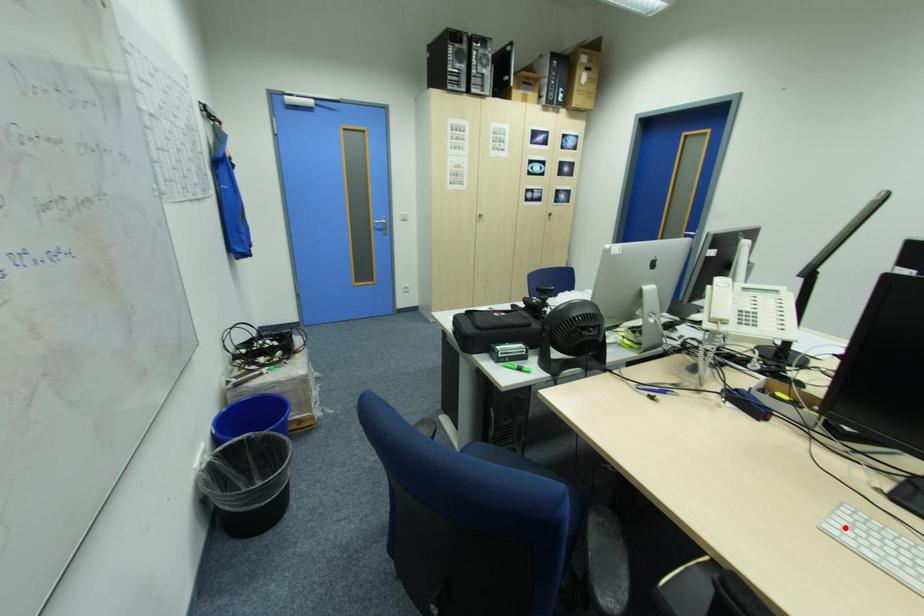
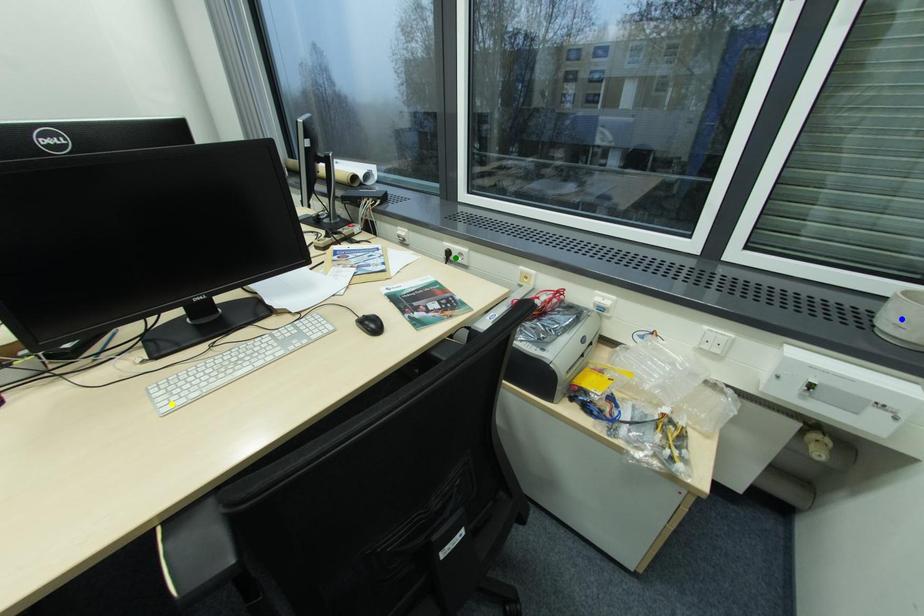
Question: I am providing you with two images of the same scene from different viewpoints. A red point is marked on the first image. You are given multiple points on the second image. Which mark in image 2 goes with the point in image 1?

Choices:
 (A) green point
 (B) blue point
 (C) yellow point

Answer: (C)